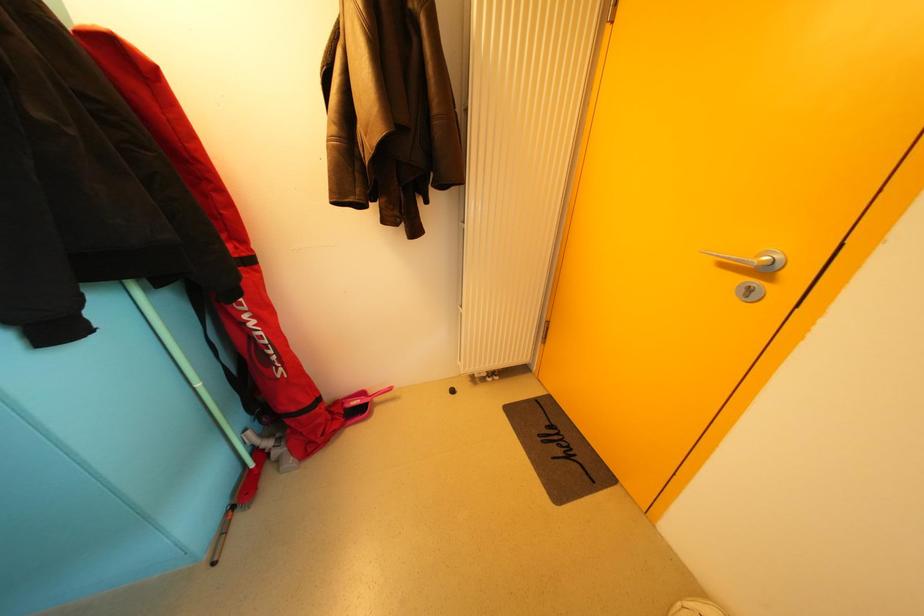
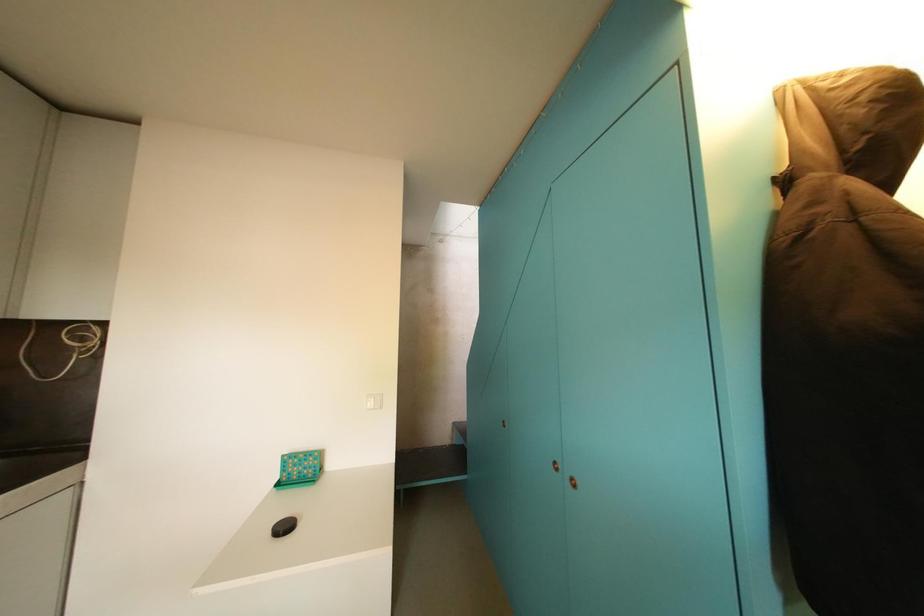
Question: How did the camera likely rotate?

Choices:
 (A) Left
 (B) Right
 (C) Up
 (D) Down

Answer: (A)